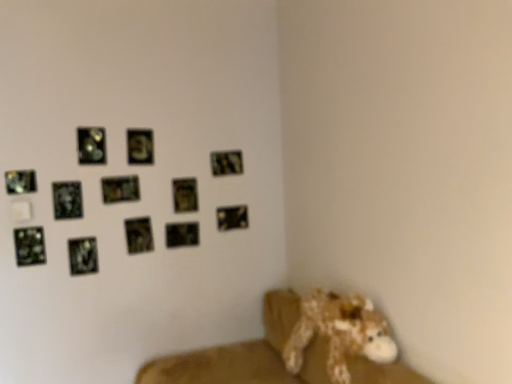
Question: From a real-world perspective, is metallic gold picture frame at upper center, which is counted as the 3th picture frame, starting from the right, positioned under metallic reflective picture frame at upper center, which ranks as the seventh picture frame in right-to-left order, based on gravity?

Choices:
 (A) no
 (B) yes

Answer: (B)

Question: Considering the relative sizes of metallic gold picture frame at upper center, which is the tenth picture frame in left-to-right order, and metallic reflective picture frame at upper center, which ranks as the seventh picture frame in right-to-left order, in the image provided, is metallic gold picture frame at upper center, which is the tenth picture frame in left-to-right order, shorter than metallic reflective picture frame at upper center, which ranks as the seventh picture frame in right-to-left order,?

Choices:
 (A) no
 (B) yes

Answer: (A)

Question: Does metallic gold picture frame at upper center, which is counted as the 3th picture frame, starting from the right, have a smaller size compared to metallic reflective picture frame at upper center, placed as the sixth picture frame when sorted from left to right?

Choices:
 (A) yes
 (B) no

Answer: (A)

Question: From the image's perspective, is metallic gold picture frame at upper center, which is counted as the 3th picture frame, starting from the right, beneath metallic reflective picture frame at upper center, which ranks as the seventh picture frame in right-to-left order?

Choices:
 (A) yes
 (B) no

Answer: (A)

Question: Is metallic gold picture frame at upper center, which is the tenth picture frame in left-to-right order, at the right side of metallic reflective picture frame at upper center, which ranks as the seventh picture frame in right-to-left order?

Choices:
 (A) no
 (B) yes

Answer: (B)

Question: Would you say metallic gold picture frame at upper center, which is the tenth picture frame in left-to-right order, is a long distance from metallic reflective picture frame at upper center, which ranks as the seventh picture frame in right-to-left order?

Choices:
 (A) no
 (B) yes

Answer: (A)

Question: Can you confirm if fuzzy brown stuffed animal at lower right is positioned to the left of metallic reflective picture frame at upper left, which is the 4th picture frame from left to right?

Choices:
 (A) no
 (B) yes

Answer: (A)

Question: Is fuzzy brown stuffed animal at lower right facing away from metallic reflective picture frame at upper left, acting as the ninth picture frame starting from the right?

Choices:
 (A) no
 (B) yes

Answer: (A)

Question: Is fuzzy brown stuffed animal at lower right not inside metallic reflective picture frame at upper left, which is the 4th picture frame from left to right?

Choices:
 (A) yes
 (B) no

Answer: (A)

Question: From a real-world perspective, does fuzzy brown stuffed animal at lower right stand above metallic reflective picture frame at upper left, which is the 4th picture frame from left to right?

Choices:
 (A) yes
 (B) no

Answer: (B)

Question: Is fuzzy brown stuffed animal at lower right at the right side of metallic reflective picture frame at upper left, which is the 4th picture frame from left to right?

Choices:
 (A) yes
 (B) no

Answer: (A)

Question: Does fuzzy brown stuffed animal at lower right have a greater width compared to metallic reflective picture frame at upper left, acting as the ninth picture frame starting from the right?

Choices:
 (A) yes
 (B) no

Answer: (A)

Question: Does metallic silver picture frame at center, the seventh picture frame when ordered from left to right, have a lesser height compared to metallic reflective picture frame at upper left, which is the 4th picture frame from left to right?

Choices:
 (A) no
 (B) yes

Answer: (B)